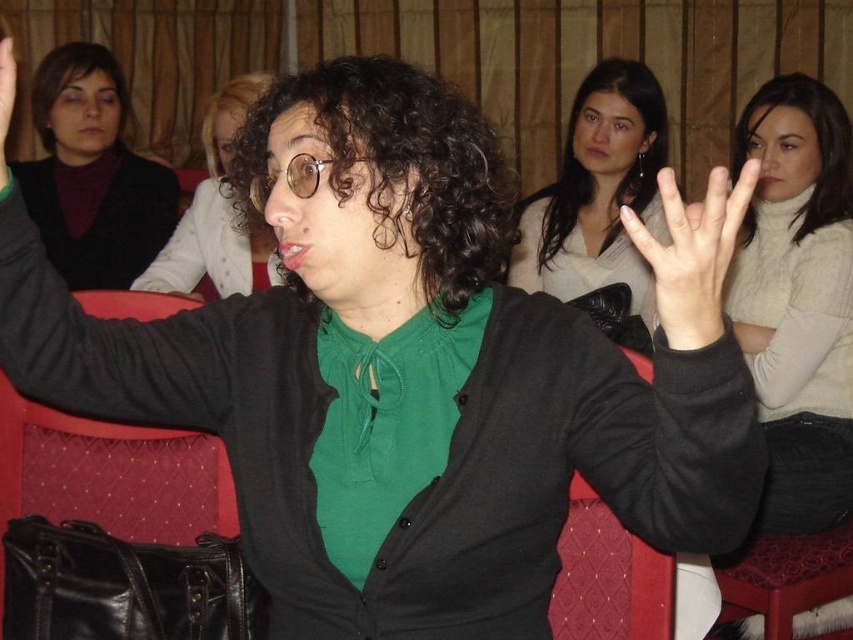
You are an observer in the classroom scene. You notice the matte white blouse at upper center and the matte black hand at upper center. Which object occupies a larger area in the image?

The matte white blouse at upper center is bigger than the matte black hand at upper center, so the matte white blouse at upper center occupies a larger area in the image.

In the scene shown: You are an artist trying to sketch the scene. You need to decide the size of the knitted white sweater at upper right and the smooth skin hand at center. Which object should you draw larger?

The knitted white sweater at upper right should be drawn larger than the smooth skin hand at center because it is larger in size according to the description.